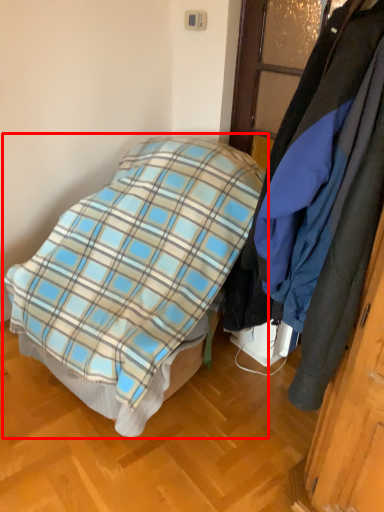
Question: From the image's perspective, considering the relative positions of bed (annotated by the red box) and cloak in the image provided, where is bed (annotated by the red box) located with respect to the staircase?

Choices:
 (A) above
 (B) below

Answer: (B)